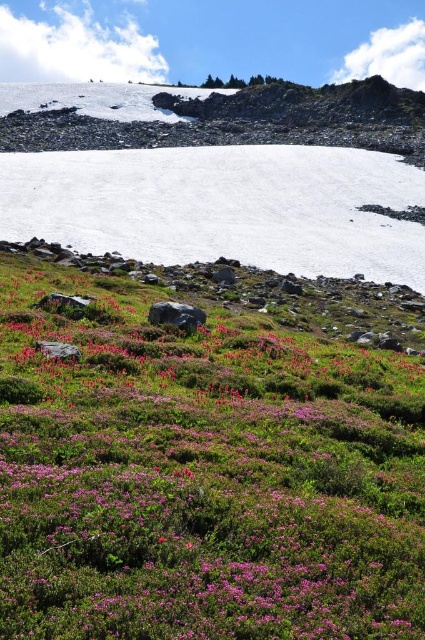
You are a hiker who wants to place a 10cm wide hiking pole between the purple leafy grass at lower center and the white matte snow at center. Can you fit it there?

The purple leafy grass at lower center is thinner than the white matte snow at center. Since the grass is thinner, the space between them is sufficient to fit a 10cm wide hiking pole.

You are a hiker who wants to take a photo of the purple leafy grass at lower center and the white matte snow at center. Which object will appear smaller in the photo?

The purple leafy grass at lower center will appear smaller in the photo because it is not as tall as the white matte snow at center.